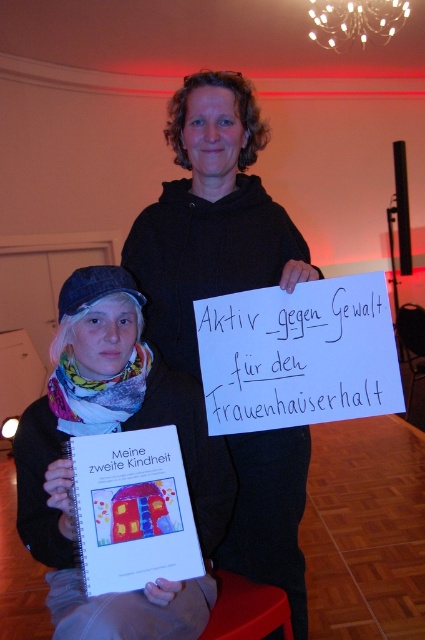
At what (x,y) coordinates should I click in order to perform the action: click on black hoodie at center. Please return your answer as a coordinate pair (x, y). The image size is (425, 640). Looking at the image, I should click on (210, 218).

Is black hoodie at center to the left of white fabric scarf at lower left from the viewer's perspective?

Incorrect, black hoodie at center is not on the left side of white fabric scarf at lower left.

Which is in front, point (274, 461) or point (73, 321)?

Positioned in front is point (73, 321).

Where is `black hoodie at center`? black hoodie at center is located at coordinates (210, 218).